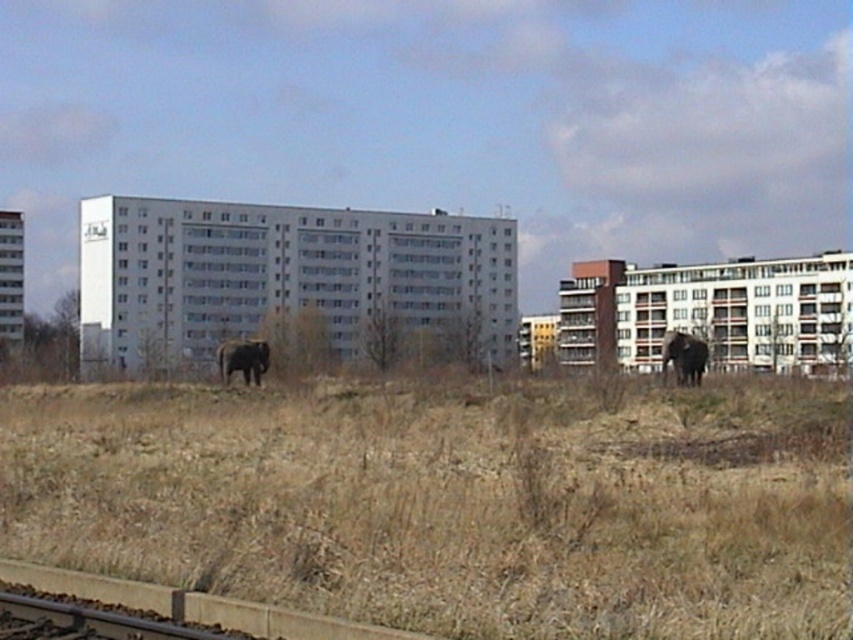
Question: Which of the following is the farthest from the observer?

Choices:
 (A) brown dry grass at center
 (B) dark brown elephant at right
 (C) dark gray elephant at center

Answer: (C)

Question: Does brown dry grass at center have a lesser width compared to dark brown elephant at right?

Choices:
 (A) yes
 (B) no

Answer: (B)

Question: Can you confirm if dark brown elephant at right is wider than dark gray elephant at center?

Choices:
 (A) yes
 (B) no

Answer: (B)

Question: Among these points, which one is farthest from the camera?

Choices:
 (A) (297, 529)
 (B) (682, 364)
 (C) (233, 364)

Answer: (C)

Question: Can you confirm if brown dry grass at center is wider than dark brown elephant at right?

Choices:
 (A) yes
 (B) no

Answer: (A)

Question: Which point is farther to the camera?

Choices:
 (A) (265, 368)
 (B) (663, 364)

Answer: (A)